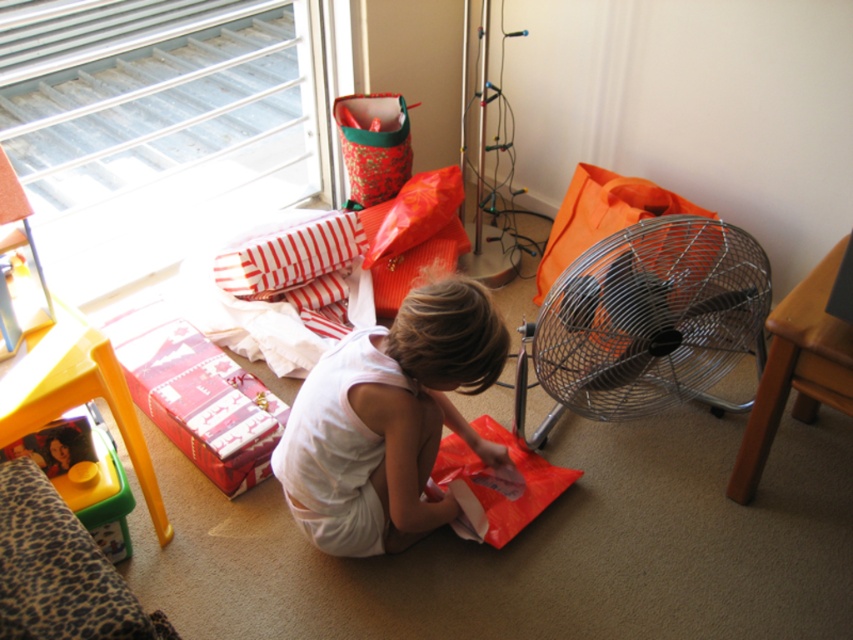
Does white fabric child at center have a lesser height compared to red shiny wrapping paper at lower left?

No.

Is the position of white fabric child at center more distant than that of red shiny wrapping paper at lower left?

No, it is in front of red shiny wrapping paper at lower left.

Identify the location of white fabric child at center. Image resolution: width=853 pixels, height=640 pixels. (387, 420).

Is white fabric child at center to the right of metallic silver fan at right from the viewer's perspective?

In fact, white fabric child at center is to the left of metallic silver fan at right.

Is white fabric child at center shorter than metallic silver fan at right?

No.

Between point (346, 412) and point (720, 225), which one is positioned behind?

Point (720, 225)

The width and height of the screenshot is (853, 640). In order to click on white fabric child at center in this screenshot , I will do `click(387, 420)`.

Which is behind, point (720, 321) or point (207, 416)?

Positioned behind is point (207, 416).

Who is more distant from viewer, (618, 403) or (173, 356)?

The point (173, 356) is behind.

You are a GUI agent. You are given a task and a screenshot of the screen. Output one action in this format:
    pyautogui.click(x=<x>, y=<y>)
    Task: Click on the metallic silver fan at right
    The height and width of the screenshot is (640, 853).
    Given the screenshot: What is the action you would take?
    pyautogui.click(x=646, y=321)